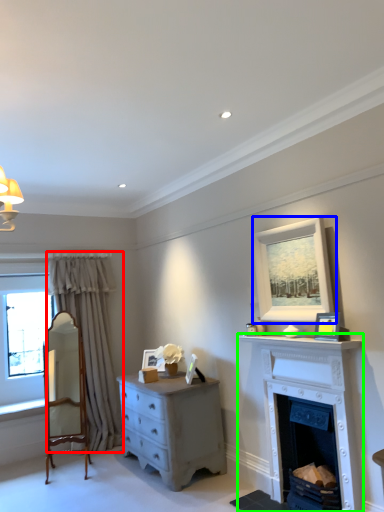
Question: Which object is the closest to the curtain (highlighted by a red box)? Choose among these: picture frame (highlighted by a blue box) or fireplace (highlighted by a green box).

Choices:
 (A) picture frame
 (B) fireplace

Answer: (B)